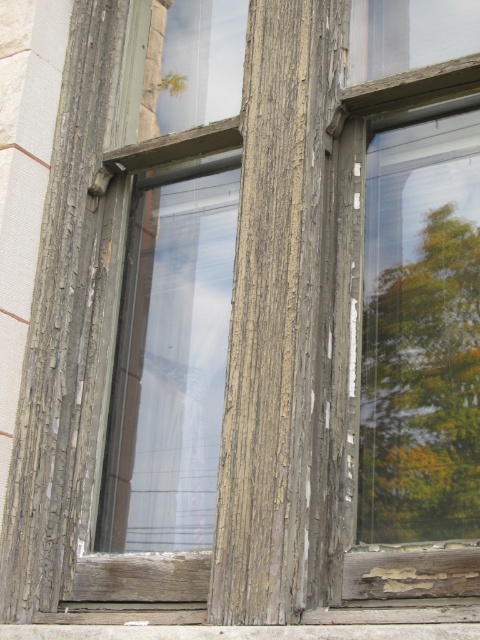
Can you confirm if green leafy tree at right is taller than wooden plank at lower center?

Correct, green leafy tree at right is much taller as wooden plank at lower center.

Which of these two, green leafy tree at right or wooden plank at lower center, stands shorter?

wooden plank at lower center

You are a GUI agent. You are given a task and a screenshot of the screen. Output one action in this format:
    pyautogui.click(x=<x>, y=<y>)
    Task: Click on the green leafy tree at right
    The height and width of the screenshot is (640, 480).
    Given the screenshot: What is the action you would take?
    pyautogui.click(x=422, y=390)